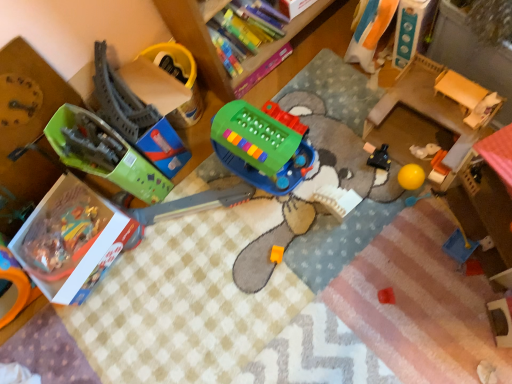
You are a GUI agent. You are given a task and a screenshot of the screen. Output one action in this format:
    pyautogui.click(x=<x>, y=<y>)
    Task: Click on the vacant point to the left of wooden changing table at right
    Image resolution: width=512 pixels, height=384 pixels.
    Given the screenshot: What is the action you would take?
    pyautogui.click(x=356, y=173)